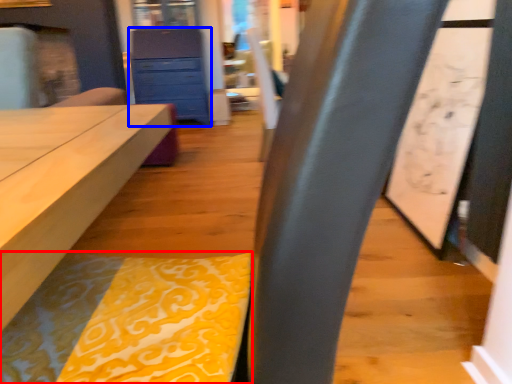
Question: Which object is closer to the camera taking this photo, blanket (highlighted by a red box) or chest of drawers (highlighted by a blue box)?

Choices:
 (A) blanket
 (B) chest of drawers

Answer: (A)